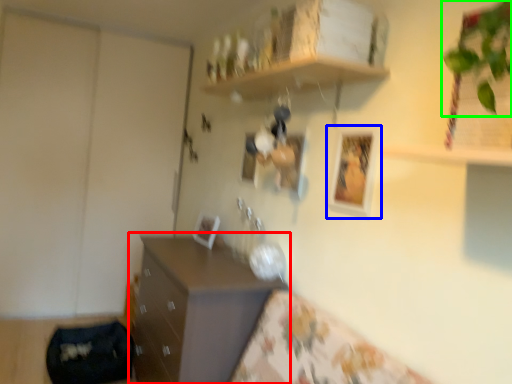
Question: Which object is positioned closest to chest of drawers (highlighted by a red box)? Select from picture frame (highlighted by a blue box) and plant (highlighted by a green box).

Choices:
 (A) picture frame
 (B) plant

Answer: (A)